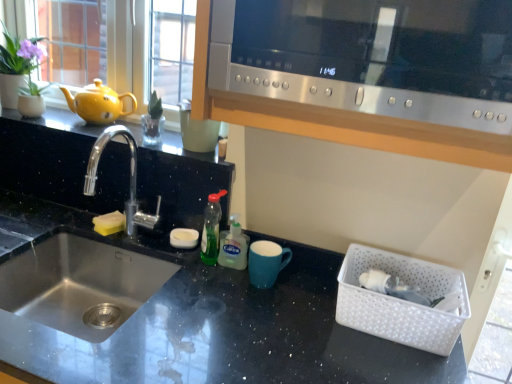
Question: Would you say matte blue mug at center is outside green translucent soap dispenser at center, which appears as the 2th bottle when viewed from the left?

Choices:
 (A) yes
 (B) no

Answer: (A)

Question: From the image's perspective, is matte blue mug at center beneath green translucent soap dispenser at center, which is the first bottle from right to left?

Choices:
 (A) yes
 (B) no

Answer: (A)

Question: Is matte blue mug at center to the right of green translucent soap dispenser at center, which is the first bottle from right to left, from the viewer's perspective?

Choices:
 (A) no
 (B) yes

Answer: (B)

Question: Considering the relative sizes of matte blue mug at center and green translucent soap dispenser at center, which appears as the 2th bottle when viewed from the left, in the image provided, is matte blue mug at center thinner than green translucent soap dispenser at center, which appears as the 2th bottle when viewed from the left,?

Choices:
 (A) yes
 (B) no

Answer: (B)

Question: Is the depth of matte blue mug at center greater than that of green translucent soap dispenser at center, which is the first bottle from right to left?

Choices:
 (A) no
 (B) yes

Answer: (A)

Question: Is matte blue mug at center wider than green translucent soap dispenser at center, which is the first bottle from right to left?

Choices:
 (A) yes
 (B) no

Answer: (A)

Question: Does black granite countertop at center have a smaller size compared to yellow matte teapot at left?

Choices:
 (A) yes
 (B) no

Answer: (B)

Question: Is black granite countertop at center not within yellow matte teapot at left?

Choices:
 (A) yes
 (B) no

Answer: (A)

Question: Is yellow matte teapot at left completely or partially inside black granite countertop at center?

Choices:
 (A) yes
 (B) no

Answer: (B)

Question: Is black granite countertop at center oriented towards yellow matte teapot at left?

Choices:
 (A) no
 (B) yes

Answer: (A)

Question: From the image's perspective, is black granite countertop at center beneath yellow matte teapot at left?

Choices:
 (A) yes
 (B) no

Answer: (A)

Question: Is the position of black granite countertop at center less distant than that of yellow matte teapot at left?

Choices:
 (A) no
 (B) yes

Answer: (B)

Question: From a real-world perspective, does green translucent bottle at center, which is counted as the 2th bottle, starting from the right, sit lower than silver metallic faucet at left?

Choices:
 (A) no
 (B) yes

Answer: (B)